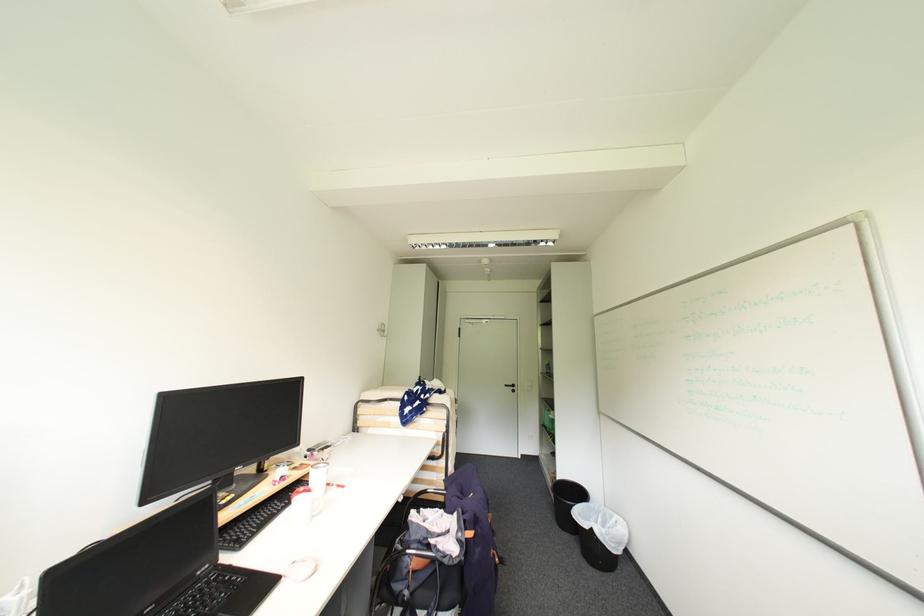
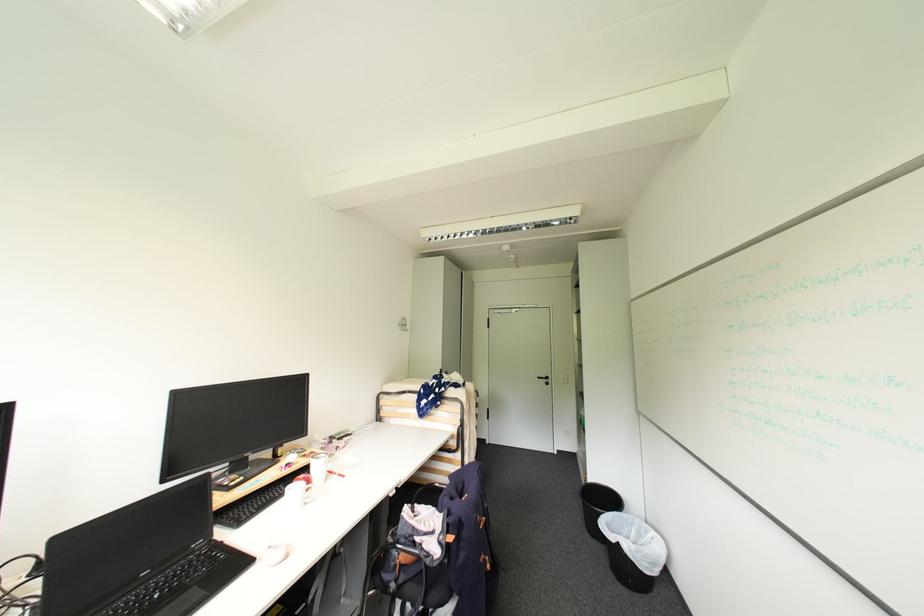
The point at (x=513, y=387) is marked in the first image. Where is the corresponding point in the second image?

(544, 379)